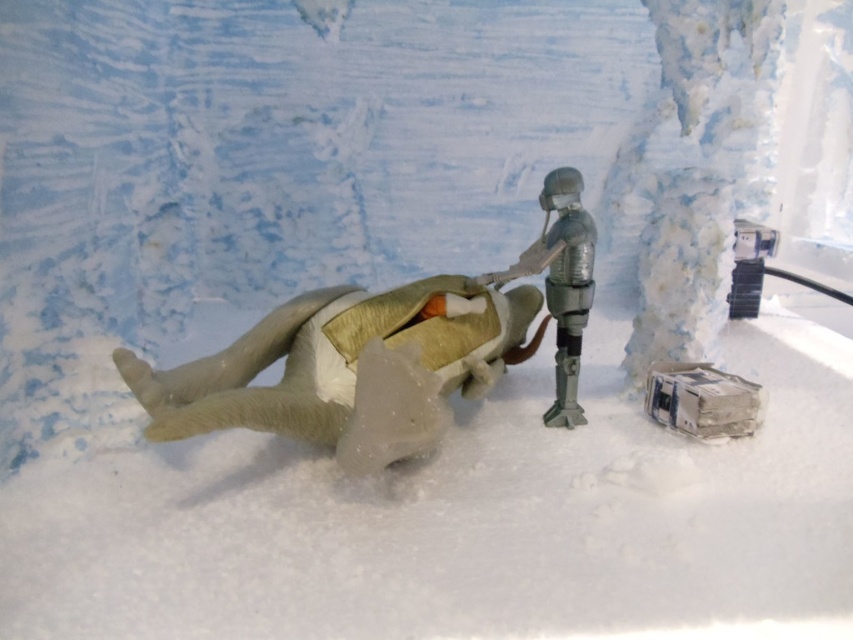
Which of these two, fuzzy gray animal at center or metallic silver figure at center, stands shorter?

fuzzy gray animal at center is shorter.

Is fuzzy gray animal at center closer to the viewer compared to metallic silver figure at center?

Yes, it is in front of metallic silver figure at center.

Which is in front, point (247, 422) or point (566, 412)?

Point (247, 422) is more forward.

This screenshot has width=853, height=640. I want to click on fuzzy gray animal at center, so click(x=347, y=369).